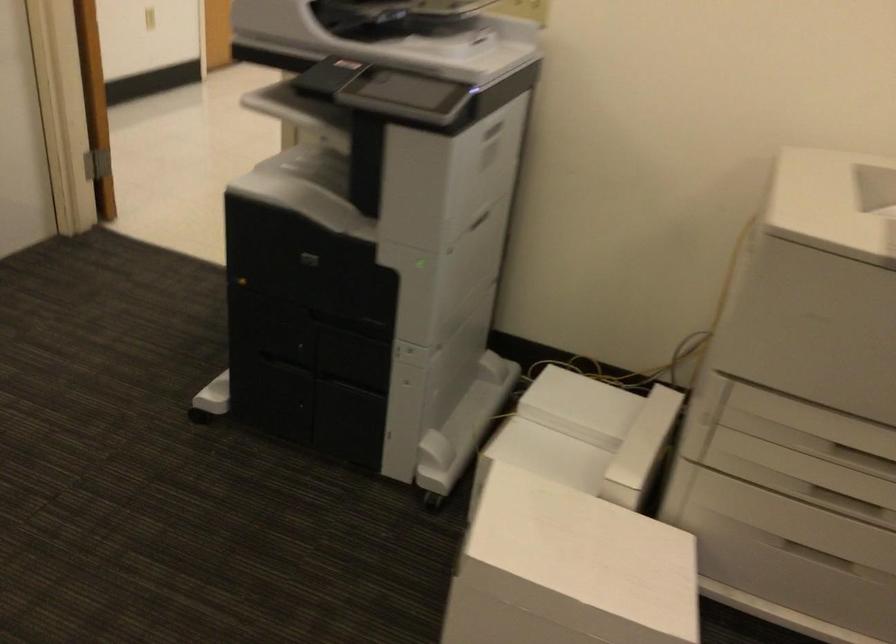
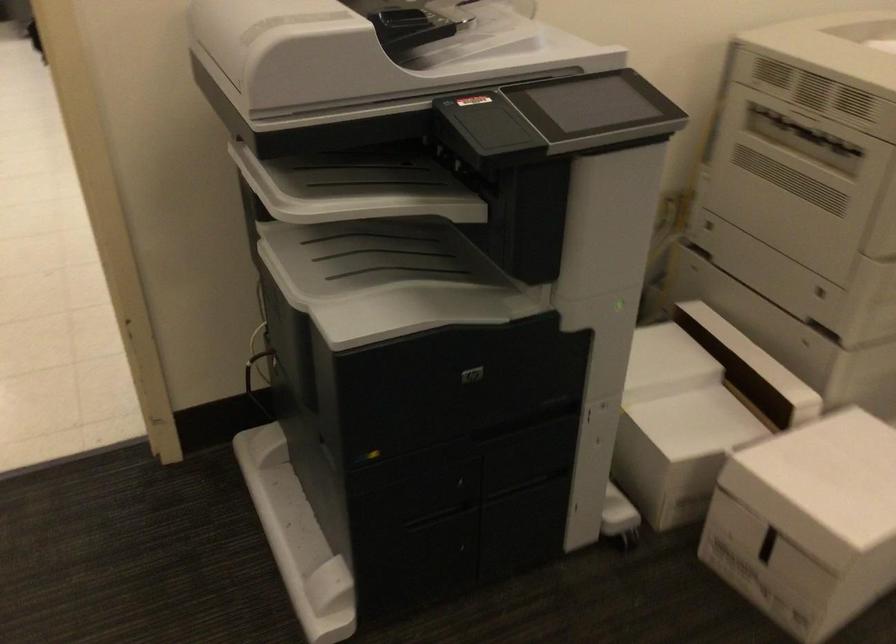
Find the pixel in the second image that matches pixel 527 520 in the first image.

(822, 484)